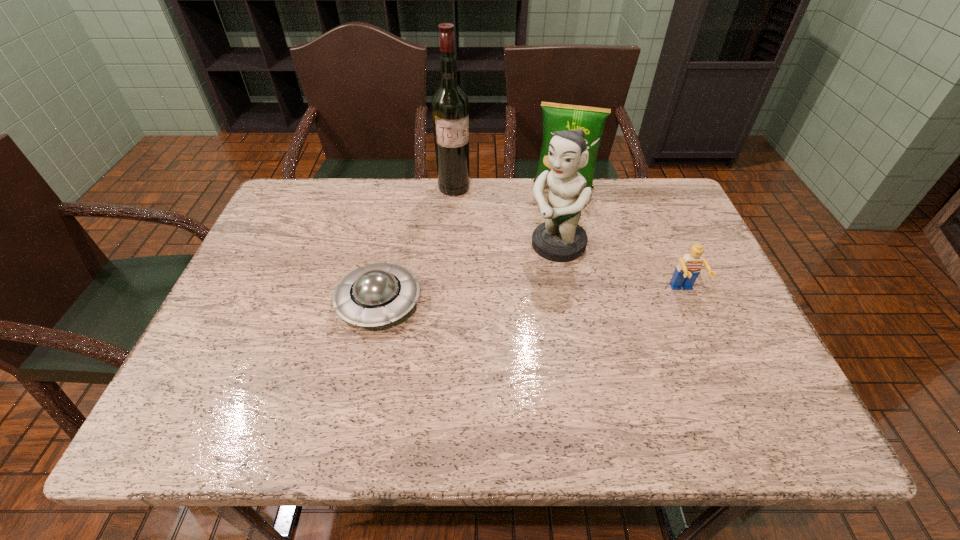
Where is `the closest object to the fourth shortest object`? the closest object to the fourth shortest object is located at coordinates (556, 117).

In order to click on free space in the image that satisfies the following two spatial constraints: 1. on the back side of the third shortest object; 2. on the right side of the figurine in this screenshot , I will do `click(546, 187)`.

This screenshot has width=960, height=540. What are the coordinates of `free space that satisfies the following two spatial constraints: 1. on the front side of the third nearest object; 2. on the right side of the wine bottle` in the screenshot? It's located at (450, 245).